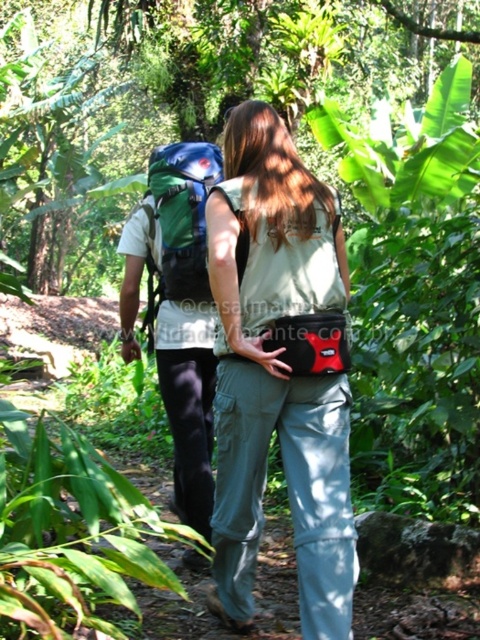
You are planning to take a photo of the two hikers in the forest. The camera is set to focus on the matte green backpack at center. Will the green fabric backpack at center be in focus as well?

The matte green backpack at center is positioned under the green fabric backpack at center, so the green fabric backpack at center will be in focus if the camera is focused on the matte green backpack at center since they are at the same distance from the camera.

You are planning to pack your camping gear for a weekend trip. You see two backpacks available in the image, the matte green backpack at center and the green fabric backpack at center. Which backpack should you choose if you need more vertical space for your gear?

The matte green backpack at center has a greater height compared to the green fabric backpack at center, so you should choose the matte green backpack at center for more vertical space.